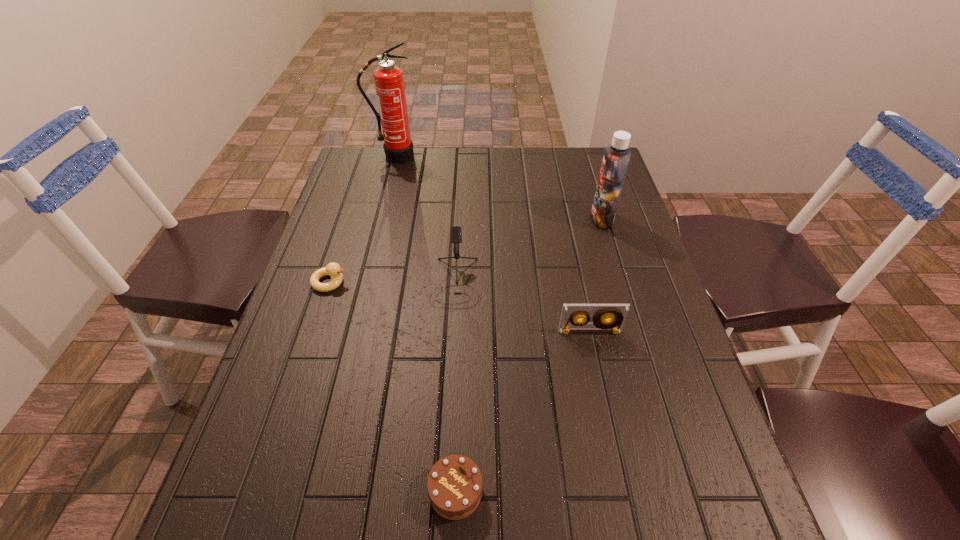
What are the coordinates of `blank area in the image that satisfies the following two spatial constraints: 1. at the beak of the duckling; 2. on the left side of the nearest object` in the screenshot? It's located at (262, 491).

Where is `vacant space that satisfies the following two spatial constraints: 1. on the stand of the third tallest object; 2. at the beak of the duckling`? Image resolution: width=960 pixels, height=540 pixels. vacant space that satisfies the following two spatial constraints: 1. on the stand of the third tallest object; 2. at the beak of the duckling is located at coordinates (455, 282).

Locate an element on the screen. free point that satisfies the following two spatial constraints: 1. at the beak of the duckling; 2. on the right side of the chocolate cake is located at coordinates (262, 491).

The image size is (960, 540). Identify the location of free space that satisfies the following two spatial constraints: 1. on the front-facing side of the farthest object; 2. on the right side of the chocolate cake. 309,491.

Image resolution: width=960 pixels, height=540 pixels. What are the coordinates of `vacant region that satisfies the following two spatial constraints: 1. on the stand of the third tallest object; 2. at the beak of the duckling` in the screenshot? It's located at (455, 282).

Locate an element on the screen. The height and width of the screenshot is (540, 960). vacant region that satisfies the following two spatial constraints: 1. on the front-facing side of the nearest object; 2. on the left side of the tallest object is located at coordinates (309, 491).

I want to click on vacant space that satisfies the following two spatial constraints: 1. on the front-facing side of the nearest object; 2. on the left side of the farthest object, so click(x=309, y=491).